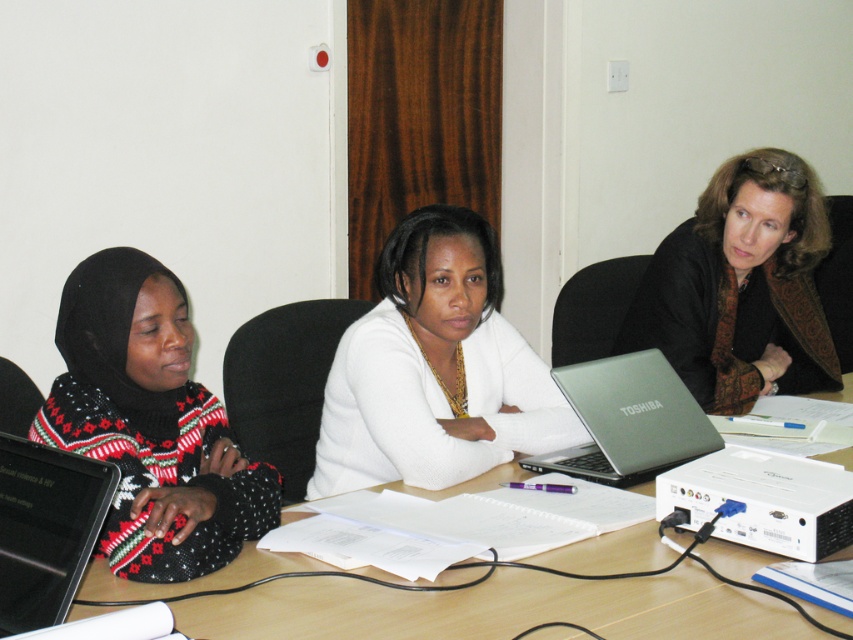
Question: Which point is farther to the camera?

Choices:
 (A) (663, 448)
 (B) (316, 612)
 (C) (676, 321)
 (D) (62, 520)

Answer: (C)

Question: Does black knitted sweater at left lie in front of matte black jacket at center?

Choices:
 (A) no
 (B) yes

Answer: (B)

Question: Which object appears farthest from the camera in this image?

Choices:
 (A) matte black jacket at center
 (B) silver metallic laptop at center
 (C) wooden table at center
 (D) black knitted sweater at left

Answer: (A)

Question: Can you confirm if white matte sweater at center is positioned to the right of black glossy laptop at left?

Choices:
 (A) no
 (B) yes

Answer: (B)

Question: Where is matte black jacket at center located in relation to wooden table at center in the image?

Choices:
 (A) above
 (B) below

Answer: (A)

Question: Which point appears closest to the camera in this image?

Choices:
 (A) (9, 380)
 (B) (12, 556)
 (C) (213, 436)
 (D) (809, 372)

Answer: (B)